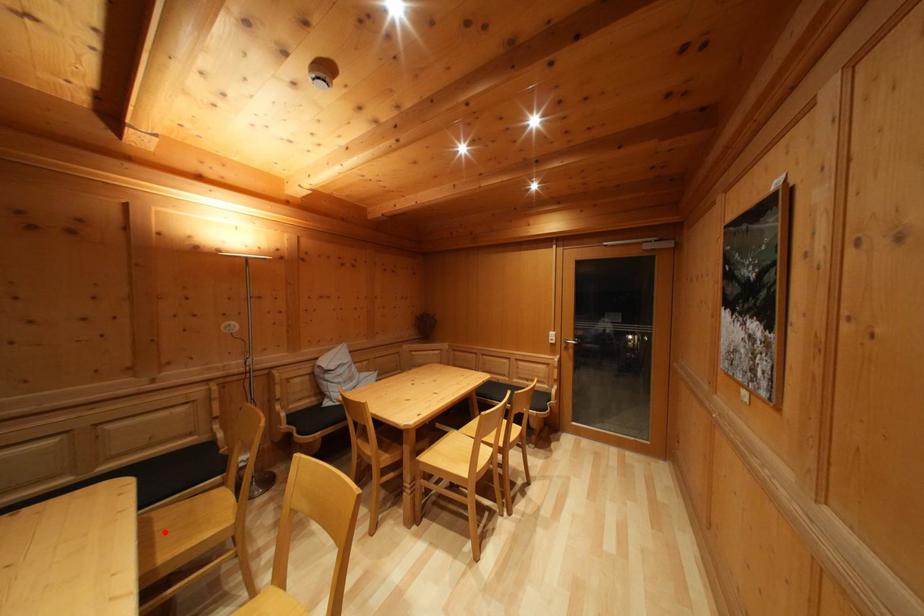
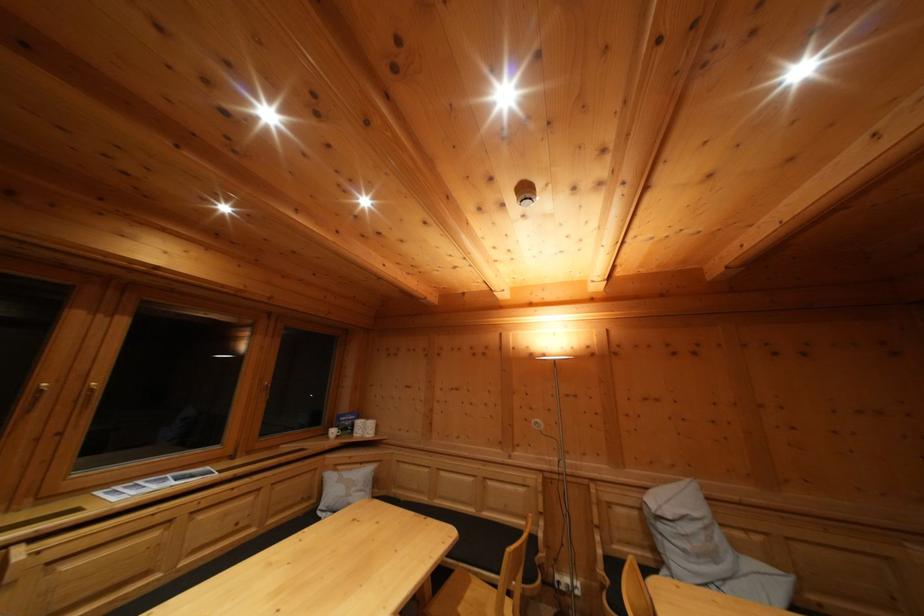
In the second image, find the point that corresponds to the highlighted location in the first image.

(475, 601)